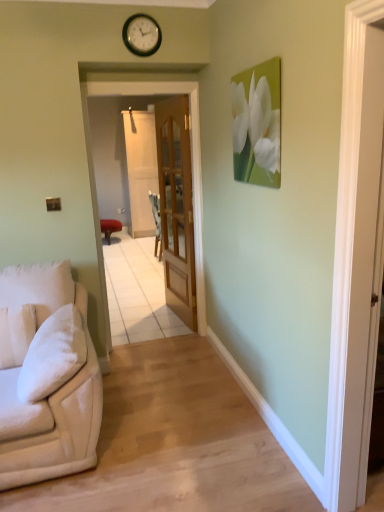
The height and width of the screenshot is (512, 384). What do you see at coordinates (176, 206) in the screenshot?
I see `wooden glass door at center` at bounding box center [176, 206].

What do you see at coordinates (16, 334) in the screenshot? Image resolution: width=384 pixels, height=512 pixels. I see `white soft pillow at left` at bounding box center [16, 334].

Consider the image. Measure the distance between beige fabric couch at left and camera.

A distance of 6.55 feet exists between beige fabric couch at left and camera.

The width and height of the screenshot is (384, 512). Identify the location of wooden glass door at center. (176, 206).

From the image's perspective, would you say metallic gold clock at upper center is shown under white soft pillow at left?

No, from the image's perspective, metallic gold clock at upper center is not below white soft pillow at left.

Considering the relative positions of metallic gold clock at upper center and white soft pillow at left in the image provided, is metallic gold clock at upper center behind white soft pillow at left?

Yes, the depth of metallic gold clock at upper center is greater than that of white soft pillow at left.

Considering the positions of objects metallic gold clock at upper center and white soft pillow at left in the image provided, who is more to the left, metallic gold clock at upper center or white soft pillow at left?

white soft pillow at left.

From a real-world perspective, is metallic gold clock at upper center on top of white soft pillow at left?

Correct, in the physical world, metallic gold clock at upper center is higher than white soft pillow at left.

Considering the positions of objects metallic gold clock at upper center and clear glass screen door at center, marked as the second screen door in a front-to-back arrangement, in the image provided, who is more to the right, metallic gold clock at upper center or clear glass screen door at center, marked as the second screen door in a front-to-back arrangement,?

metallic gold clock at upper center.

From the image's perspective, is metallic gold clock at upper center above clear glass screen door at center, marked as the second screen door in a front-to-back arrangement?

Incorrect, from the image's perspective, metallic gold clock at upper center is lower than clear glass screen door at center, marked as the second screen door in a front-to-back arrangement.

Does metallic gold clock at upper center lie behind clear glass screen door at center, which appears as the first screen door when viewed from the back?

No, metallic gold clock at upper center is in front of clear glass screen door at center, which appears as the first screen door when viewed from the back.

What's the angular difference between metallic gold clock at upper center and clear glass screen door at center, marked as the second screen door in a front-to-back arrangement,'s facing directions?

5.66 degrees separate the facing orientations of metallic gold clock at upper center and clear glass screen door at center, marked as the second screen door in a front-to-back arrangement.

Can you confirm if clear glass door at center, which is the second screen door from back to front, is positioned to the left of matte red stool at center?

Incorrect, clear glass door at center, which is the second screen door from back to front, is not on the left side of matte red stool at center.

Are clear glass door at center, which is the 1th screen door in front-to-back order, and matte red stool at center located far from each other?

Yes.

Would you say clear glass door at center, which is the second screen door from back to front, is outside matte red stool at center?

Yes.

Who is bigger, white soft pillow at left or wooden glass door at center?

wooden glass door at center is bigger.

Which is in front, white soft pillow at left or wooden glass door at center?

white soft pillow at left.

Is white soft pillow at left far from wooden glass door at center?

Yes, white soft pillow at left is far from wooden glass door at center.

What's the angular difference between beige fabric couch at left and white matte flower at upper right's facing directions?

They differ by 5.76 degrees in their facing directions.

You are a GUI agent. You are given a task and a screenshot of the screen. Output one action in this format:
    pyautogui.click(x=<x>, y=<y>)
    Task: Click on the flower above the beige fabric couch at left (from the image's perspective)
    This screenshot has height=512, width=384.
    Given the screenshot: What is the action you would take?
    pyautogui.click(x=254, y=129)

Choose the correct answer: Is beige fabric couch at left inside white matte flower at upper right or outside it?

beige fabric couch at left is not enclosed by white matte flower at upper right.

Which of these two, wooden glass door at center or beige fabric couch at left, stands taller?

With more height is wooden glass door at center.

From the image's perspective, who appears lower, wooden glass door at center or beige fabric couch at left?

From the image's view, beige fabric couch at left is below.

I want to click on door behind the beige fabric couch at left, so click(176, 206).

Based on the photo, would you say wooden glass door at center is to the left or to the right of beige fabric couch at left in the picture?

wooden glass door at center is to the right of beige fabric couch at left.

Is point (117, 226) farther from viewer compared to point (133, 51)?

Yes, it is behind point (133, 51).

Considering the relative positions of matte red stool at center and metallic gold clock at upper center in the image provided, is matte red stool at center in front of metallic gold clock at upper center?

No, the depth of matte red stool at center is greater than that of metallic gold clock at upper center.

Is matte red stool at center aimed at metallic gold clock at upper center?

No, matte red stool at center does not turn towards metallic gold clock at upper center.

Who is bigger, matte red stool at center or metallic gold clock at upper center?

Bigger between the two is matte red stool at center.

The width and height of the screenshot is (384, 512). Identify the location of pillow in front of the metallic gold clock at upper center. (16, 334).

Where is `clock above the clear glass screen door at center, marked as the second screen door in a front-to-back arrangement (from a real-world perspective)`? clock above the clear glass screen door at center, marked as the second screen door in a front-to-back arrangement (from a real-world perspective) is located at coordinates (141, 35).

In the scene shown: When comparing their distances from clear glass door at center, which is the 1th screen door in front-to-back order, does white soft pillow at left or white matte flower at upper right seem closer?

Among the two, white matte flower at upper right is located nearer to clear glass door at center, which is the 1th screen door in front-to-back order.

Based on their spatial positions, is clear glass door at center, which is the second screen door from back to front, or white soft pillow at left further from wooden glass door at center?

Among the two, white soft pillow at left is located further to wooden glass door at center.

From the image, which object appears to be nearer to clear glass screen door at center, which appears as the first screen door when viewed from the back, clear glass door at center, which is the second screen door from back to front, or matte red stool at center?

matte red stool at center.

Based on their spatial positions, is white soft pillow at left or wooden glass door at center closer to clear glass screen door at center, marked as the second screen door in a front-to-back arrangement?

wooden glass door at center is positioned closer to the anchor clear glass screen door at center, marked as the second screen door in a front-to-back arrangement.

From the image, which object appears to be farther from wooden glass door at center, clear glass screen door at center, marked as the second screen door in a front-to-back arrangement, or beige fabric couch at left?

clear glass screen door at center, marked as the second screen door in a front-to-back arrangement, is further to wooden glass door at center.

Based on their spatial positions, is clear glass screen door at center, marked as the second screen door in a front-to-back arrangement, or white matte flower at upper right closer to matte red stool at center?

clear glass screen door at center, marked as the second screen door in a front-to-back arrangement, is positioned closer to the anchor matte red stool at center.

From the image, which object appears to be farther from matte red stool at center, wooden glass door at center or white matte flower at upper right?

white matte flower at upper right lies further to matte red stool at center than the other object.

Estimate the real-world distances between objects in this image. Which object is further from white matte flower at upper right, wooden glass door at center or white soft pillow at left?

Among the two, white soft pillow at left is located further to white matte flower at upper right.

The height and width of the screenshot is (512, 384). Identify the location of screen door between white soft pillow at left and matte red stool at center in the front-back direction. (191, 157).

Image resolution: width=384 pixels, height=512 pixels. I want to click on flower between beige fabric couch at left and clear glass door at center, which is the 1th screen door in front-to-back order, from front to back, so click(254, 129).

This screenshot has height=512, width=384. Find the location of `pillow between metallic gold clock at upper center and beige fabric couch at left vertically`. pillow between metallic gold clock at upper center and beige fabric couch at left vertically is located at coordinates (16, 334).

You are a GUI agent. You are given a task and a screenshot of the screen. Output one action in this format:
    pyautogui.click(x=<x>, y=<y>)
    Task: Click on the door between clear glass door at center, which is the 1th screen door in front-to-back order, and matte red stool at center, along the z-axis
    The height and width of the screenshot is (512, 384).
    Given the screenshot: What is the action you would take?
    pyautogui.click(x=176, y=206)